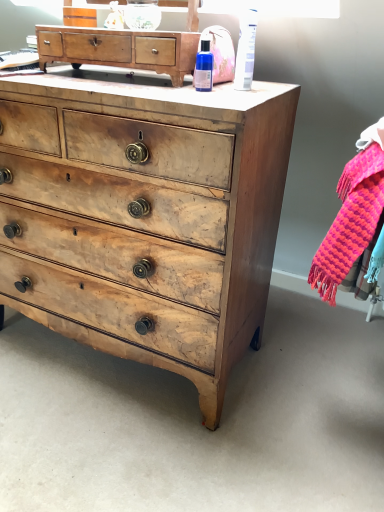
I want to click on vacant space situated on the left part of white plastic tube at upper right, the first toiletry positioned from the right, so click(x=183, y=86).